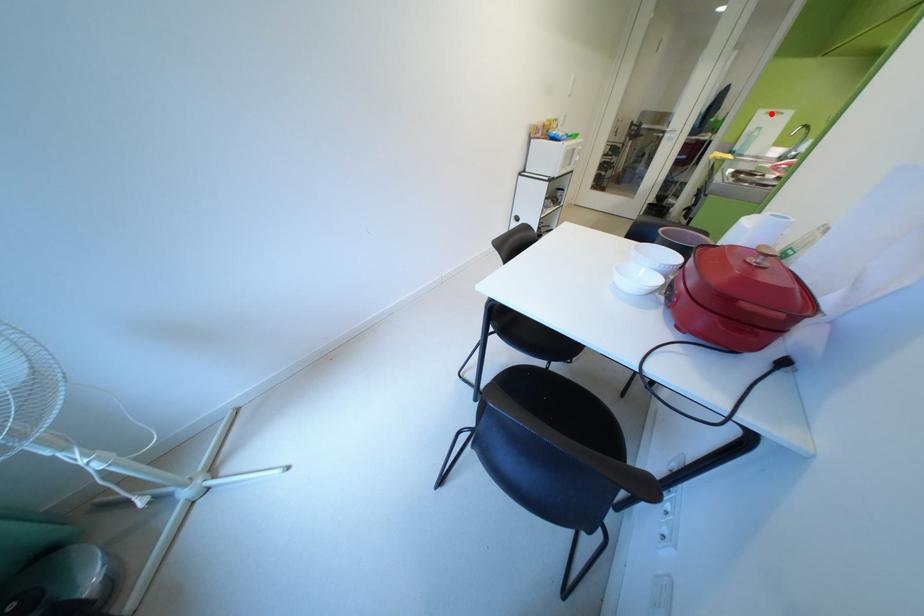
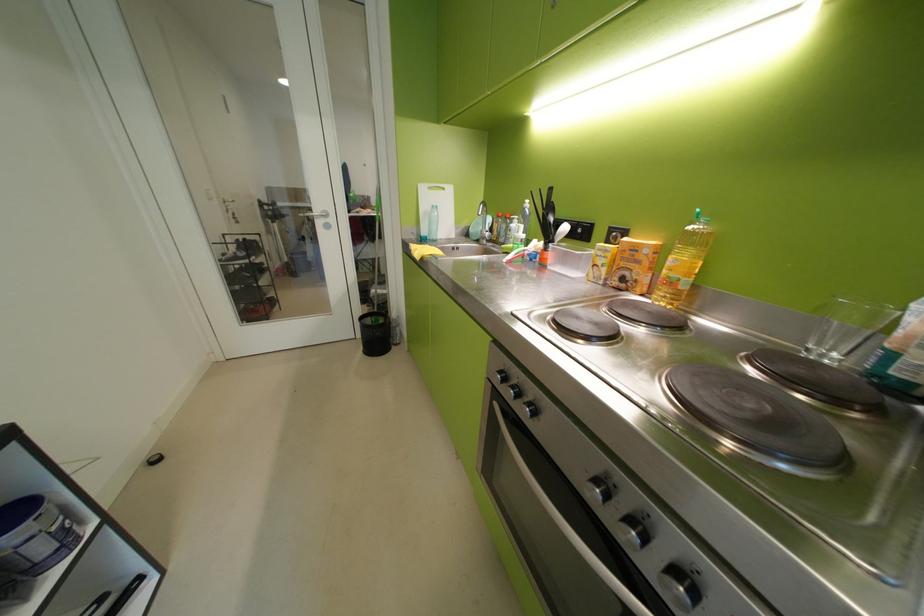
Where in the second image is the point corresponding to the highlighted location from the first image?

(433, 190)